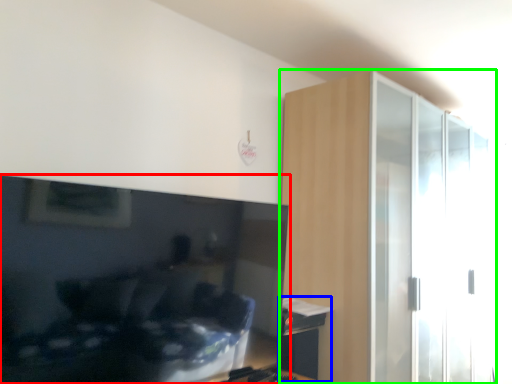
Question: Considering the real-world distances, which object is farthest from television (highlighted by a red box)? table (highlighted by a blue box) or dresser (highlighted by a green box)?

Choices:
 (A) table
 (B) dresser

Answer: (B)